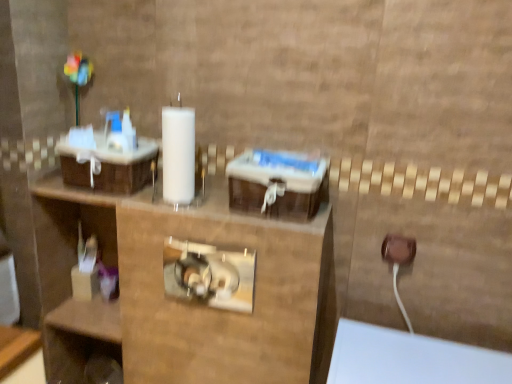
Locate an element on the screen. vacant space situated above brown woven basket at left (from a real-world perspective) is located at coordinates (108, 147).